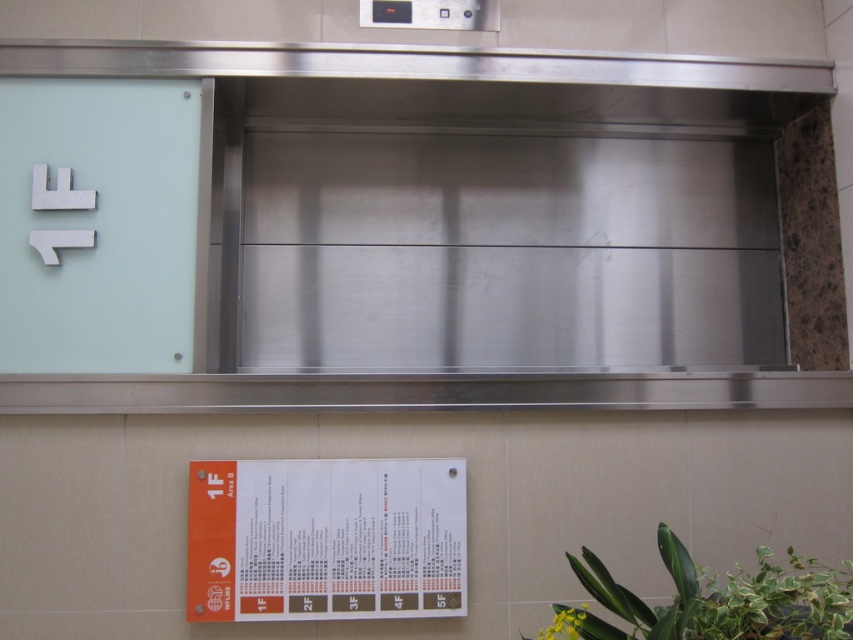
You are standing in the elevator area and notice an orange paper at lower center and a green leafy plant at lower right. Which object is narrower in width?

The orange paper at lower center is thinner than the green leafy plant at lower right, so the orange paper at lower center is narrower in width.

You are standing in the elevator area and see the point marked at coordinates (326,540). What is the nearest object to this point?

The point at (326,540) is on orange paper at lower center, so the nearest object to this point is the orange paper at lower center.

You are standing in the elevator area and see the orange paper at lower center and the green leafy plant at lower right. Which object is closer to the left side of the elevator area?

The orange paper at lower center is positioned on the left side of the green leafy plant at lower right, so it is closer to the left side of the elevator area.